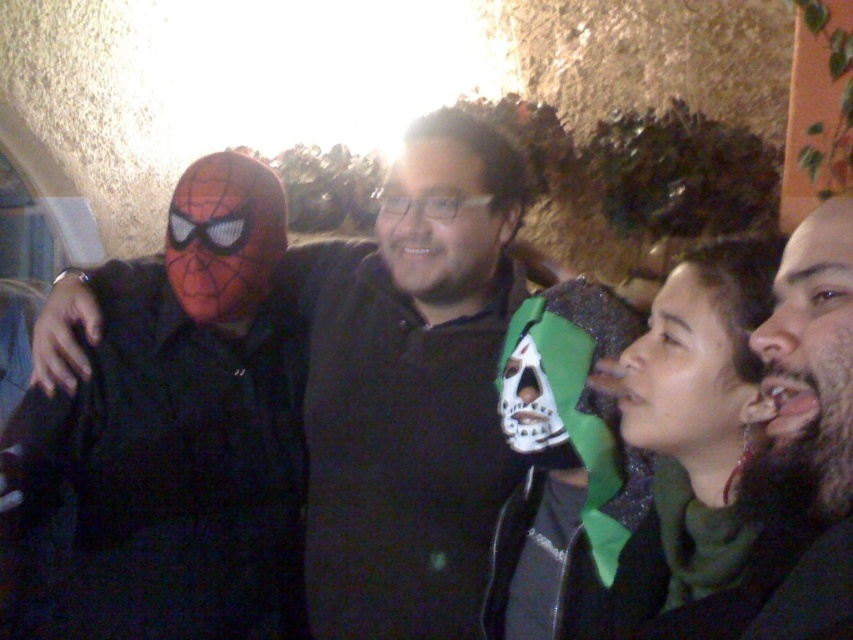
Question: Which object is farther from the camera taking this photo?

Choices:
 (A) bearded dark hair at right
 (B) matte black mask at left

Answer: (B)

Question: Among these objects, which one is farthest from the camera?

Choices:
 (A) green glittery scarf at lower right
 (B) matte black mask at left
 (C) bearded dark hair at right

Answer: (B)

Question: Which of these objects is positioned closest to the green glittery scarf at lower right?

Choices:
 (A) matte black mask at left
 (B) bearded dark hair at right

Answer: (B)

Question: Observing the image, what is the correct spatial positioning of green glittery scarf at lower right in reference to bearded dark hair at right?

Choices:
 (A) left
 (B) right

Answer: (A)

Question: Is matte black mask at left bigger than bearded dark hair at right?

Choices:
 (A) yes
 (B) no

Answer: (A)

Question: Does matte black mask at left have a lesser width compared to green glittery scarf at lower right?

Choices:
 (A) no
 (B) yes

Answer: (A)